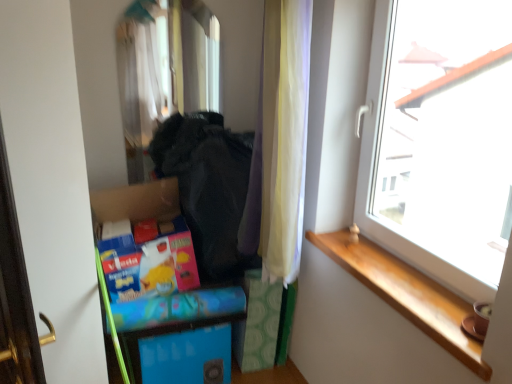
Identify the location of vacant region above wooden at right (from a real-world perspective). Image resolution: width=512 pixels, height=384 pixels. click(x=385, y=273).